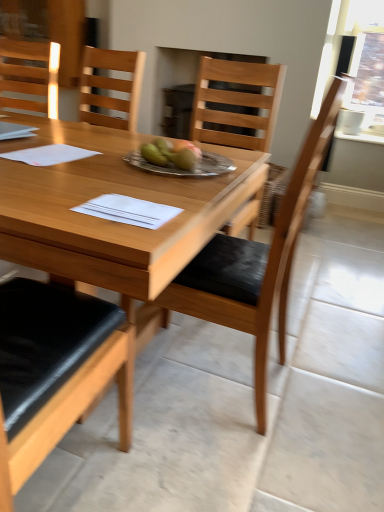
What are the coordinates of `vacant space in front of wooden chair at center, the first chair ordered from the bottom` in the screenshot? It's located at [x=218, y=459].